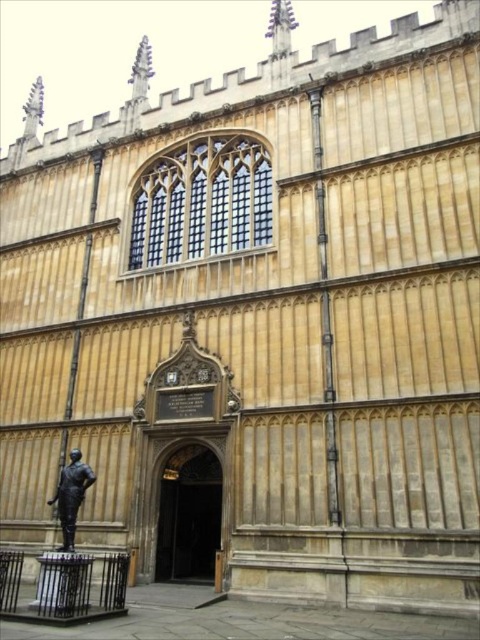
Is point (204, 490) closer to viewer compared to point (81, 484)?

No, it is behind (81, 484).

Which is above, dark brown wooden door at center or bronze statue at lower left?

bronze statue at lower left is above.

Who is more distant from viewer, (171, 509) or (68, 477)?

Positioned behind is point (171, 509).

In order to click on dark brown wooden door at center in this screenshot , I will do `click(189, 515)`.